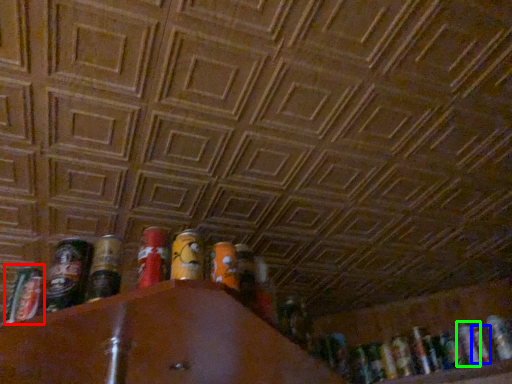
Question: Which is farther away from spray can (highlighted by a red box)? beer (highlighted by a blue box) or beer (highlighted by a green box)?

Choices:
 (A) beer
 (B) beer

Answer: (A)